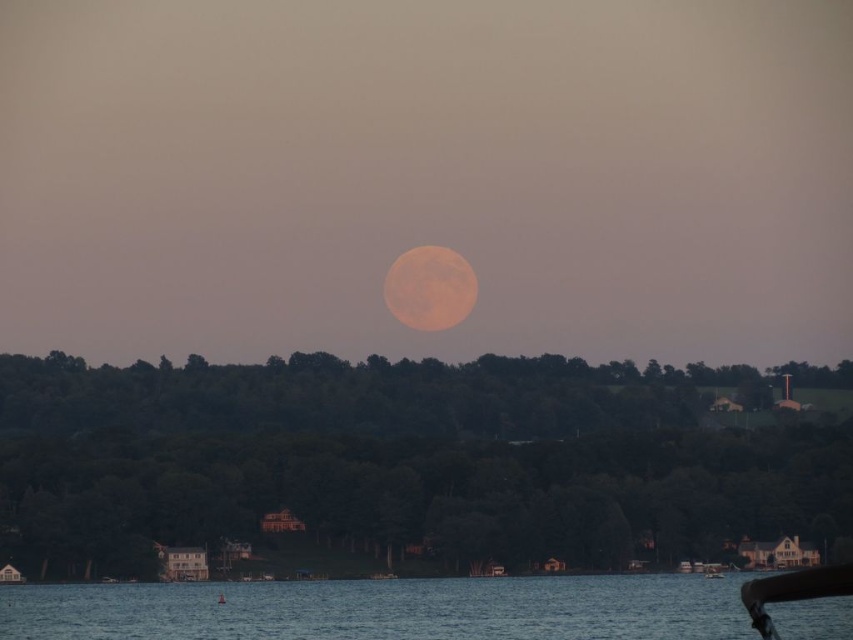
You are an astronomer observing the night sky and notice two moons in the image. Which moon, the orange matte moon at center or the orange textured moon at center, appears bigger in the sky?

The orange matte moon at center appears bigger in the sky compared to the orange textured moon at center.

You are an astronomer observing the night sky and notice two moons in the image. Which moon, the orange matte moon at center or the orange textured moon at center, has a greater width?

The orange matte moon at center has a greater width than the orange textured moon at center.

You are an astronomer observing the night sky and see the orange matte moon at center and the wooden boat at center. Which object appears taller in the scene?

The orange matte moon at center appears taller than the wooden boat at center in the scene.